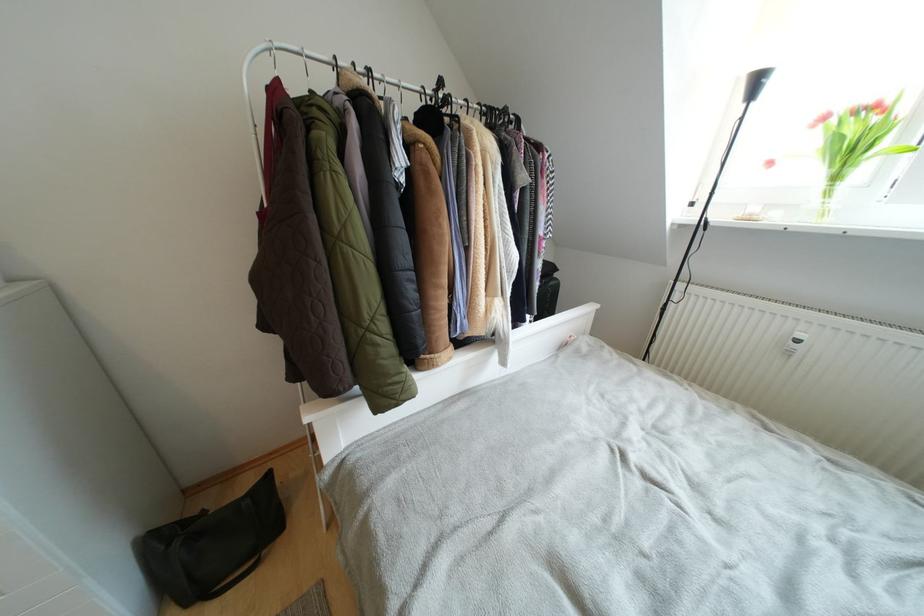
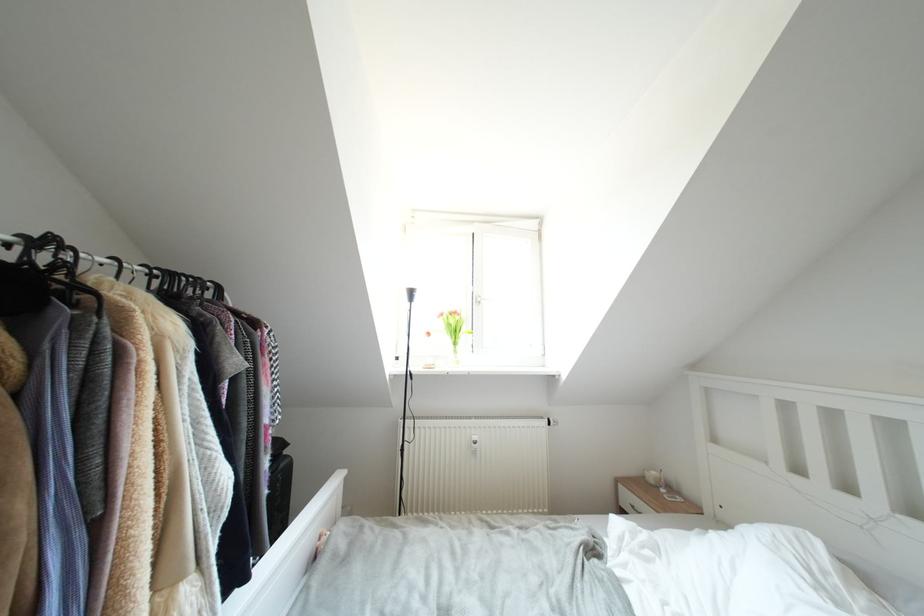
First-person continuous shooting, in which direction is the camera rotating?

The rotation direction of the camera is right-up.